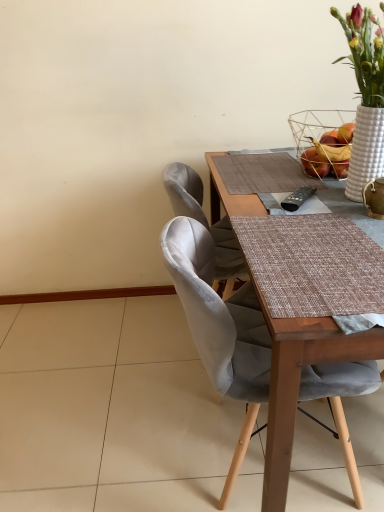
Where is `satin grey chair at center`? satin grey chair at center is located at coordinates (218, 315).

The image size is (384, 512). What do you see at coordinates (218, 315) in the screenshot?
I see `satin grey chair at center` at bounding box center [218, 315].

Measure the distance between white textured basket at upper right and camera.

The depth of white textured basket at upper right is 1.71 meters.

Image resolution: width=384 pixels, height=512 pixels. What do you see at coordinates (321, 141) in the screenshot? I see `white textured basket at upper right` at bounding box center [321, 141].

The height and width of the screenshot is (512, 384). I want to click on white textured basket at upper right, so click(321, 141).

Identify the location of satin grey chair at center. Image resolution: width=384 pixels, height=512 pixels. (218, 315).

Can you confirm if white textured basket at upper right is positioned to the left of satin grey chair at center?

No, white textured basket at upper right is not to the left of satin grey chair at center.

Considering their positions, is white textured basket at upper right located in front of or behind satin grey chair at center?

white textured basket at upper right is behind satin grey chair at center.

Which point is more forward, (x=324, y=120) or (x=239, y=383)?

The point (x=239, y=383) is in front.

From the image's perspective, is white textured basket at upper right positioned above or below satin grey chair at center?

Clearly, from the image's perspective, white textured basket at upper right is above satin grey chair at center.

From a real-world perspective, relative to satin grey chair at center, is white textured basket at upper right vertically above or below?

In terms of real-world spatial position, white textured basket at upper right is above satin grey chair at center.

Looking at this image, considering the relative sizes of white textured basket at upper right and satin grey chair at center in the image provided, is white textured basket at upper right wider than satin grey chair at center?

Incorrect, the width of white textured basket at upper right does not surpass that of satin grey chair at center.

Between white textured basket at upper right and satin grey chair at center, which one has more height?

satin grey chair at center.

Considering the sizes of objects white textured basket at upper right and satin grey chair at center in the image provided, who is smaller, white textured basket at upper right or satin grey chair at center?

white textured basket at upper right is smaller.

Do you think white textured basket at upper right is within satin grey chair at center, or outside of it?

white textured basket at upper right is not inside satin grey chair at center, it's outside.

Is white textured basket at upper right directly adjacent to satin grey chair at center?

No, white textured basket at upper right is not with satin grey chair at center.

Is white textured basket at upper right oriented away from satin grey chair at center?

No, white textured basket at upper right is not facing away from satin grey chair at center.

What's the angular difference between white textured basket at upper right and satin grey chair at center's facing directions?

They differ by 89.6 degrees in their facing directions.

Measure the distance from white textured basket at upper right to satin grey chair at center.

white textured basket at upper right is 38.12 inches away from satin grey chair at center.

Locate an element on the screen. This screenshot has height=512, width=384. basket located above the satin grey chair at center (from a real-world perspective) is located at coordinates (321, 141).

From the picture: In the image, is satin grey chair at center on the left side or the right side of white textured basket at upper right?

From the image, it's evident that satin grey chair at center is to the left of white textured basket at upper right.

Which is behind, satin grey chair at center or white textured basket at upper right?

white textured basket at upper right.

Looking at this image, which point is more distant from viewer, [201,280] or [343,175]?

Point [343,175]

From the image's perspective, who appears lower, satin grey chair at center or white textured basket at upper right?

From the image's view, satin grey chair at center is below.

From a real-world perspective, is satin grey chair at center physically located above or below white textured basket at upper right?

satin grey chair at center is below white textured basket at upper right.

Which of these two, satin grey chair at center or white textured basket at upper right, is wider?

satin grey chair at center.

Considering the sizes of objects satin grey chair at center and white textured basket at upper right in the image provided, who is shorter, satin grey chair at center or white textured basket at upper right?

With less height is white textured basket at upper right.

In terms of size, does satin grey chair at center appear bigger or smaller than white textured basket at upper right?

Considering their sizes, satin grey chair at center takes up more space than white textured basket at upper right.

Would you say satin grey chair at center is outside white textured basket at upper right?

satin grey chair at center lies outside white textured basket at upper right's area.

Is satin grey chair at center beside white textured basket at upper right?

No, satin grey chair at center is not beside white textured basket at upper right.

Is satin grey chair at center facing towards white textured basket at upper right?

No, satin grey chair at center is not turned towards white textured basket at upper right.

Where is `basket above the satin grey chair at center (from the image's perspective)`? The width and height of the screenshot is (384, 512). basket above the satin grey chair at center (from the image's perspective) is located at coordinates (321, 141).

Where is `chair in front of the white textured basket at upper right`? chair in front of the white textured basket at upper right is located at coordinates click(x=218, y=315).

The width and height of the screenshot is (384, 512). In order to click on basket above the satin grey chair at center (from a real-world perspective) in this screenshot , I will do `click(321, 141)`.